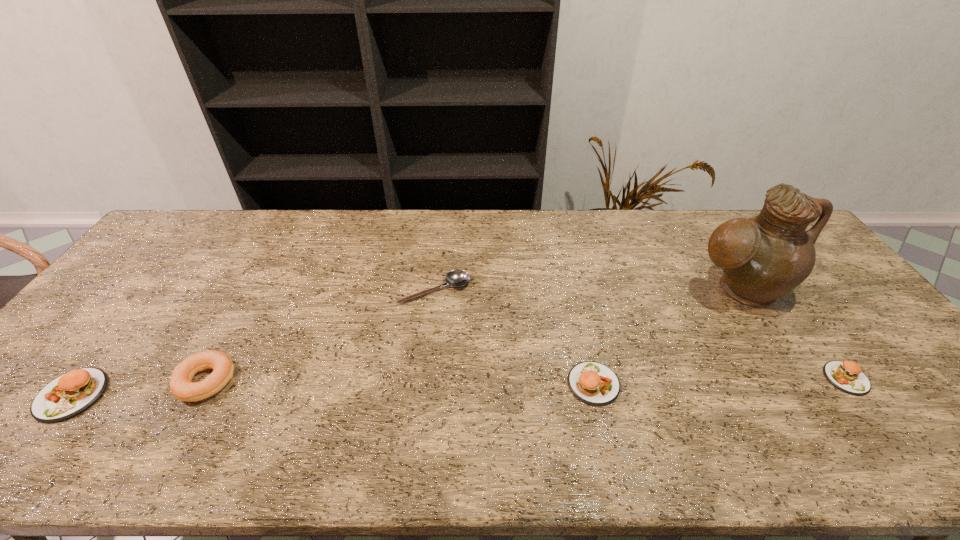
At what (x,y) coordinates should I click in order to perform the action: click on the tallest patty. Please return your answer as a coordinate pair (x, y). This screenshot has height=540, width=960. Looking at the image, I should click on (66, 396).

I want to click on the leftmost patty, so click(x=66, y=396).

In order to click on the second shortest patty in this screenshot , I will do `click(591, 382)`.

I want to click on the second patty from left to right, so click(x=591, y=382).

Where is `the shortest patty`? This screenshot has height=540, width=960. the shortest patty is located at coordinates (847, 376).

Identify the location of the second shortest object. This screenshot has height=540, width=960. (847, 376).

Image resolution: width=960 pixels, height=540 pixels. I want to click on pitcher, so click(x=764, y=257).

Image resolution: width=960 pixels, height=540 pixels. I want to click on the second object from left to right, so click(x=181, y=386).

The width and height of the screenshot is (960, 540). Identify the location of ladle. (457, 278).

The width and height of the screenshot is (960, 540). I want to click on the third object from left to right, so 457,278.